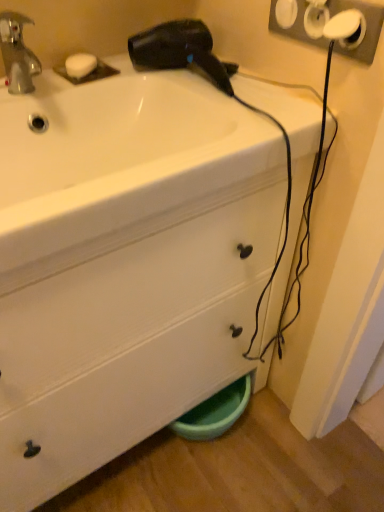
What are the coordinates of `white plastic socket at upper right` in the screenshot? It's located at (324, 23).

The image size is (384, 512). I want to click on black plastic hair dryer at upper center, so click(x=180, y=51).

From a real-world perspective, relative to white matte soap at upper left, is white plastic socket at upper right vertically above or below?

white plastic socket at upper right is above white matte soap at upper left.

From the image's perspective, would you say white plastic socket at upper right is positioned over white matte soap at upper left?

No.

Considering the sizes of objects white plastic socket at upper right and white matte soap at upper left in the image provided, who is bigger, white plastic socket at upper right or white matte soap at upper left?

Bigger between the two is white plastic socket at upper right.

Is white plastic socket at upper right closer to camera compared to white matte soap at upper left?

That is True.

From a real-world perspective, is white plastic socket at upper right positioned above or below black plastic hair dryer at upper center?

In terms of real-world spatial position, white plastic socket at upper right is above black plastic hair dryer at upper center.

Is white plastic socket at upper right not within black plastic hair dryer at upper center?

Absolutely, white plastic socket at upper right is external to black plastic hair dryer at upper center.

Based on the photo, how distant is white plastic socket at upper right from black plastic hair dryer at upper center?

white plastic socket at upper right and black plastic hair dryer at upper center are 7.52 inches apart.

Find the location of `hair drier that is on the left side of white plastic socket at upper right`. hair drier that is on the left side of white plastic socket at upper right is located at coordinates (180, 51).

From the picture: Between black plastic hair dryer at upper center and white matte soap at upper left, which one is positioned behind?

white matte soap at upper left is more distant.

From the image's perspective, is black plastic hair dryer at upper center located above or below white matte soap at upper left?

black plastic hair dryer at upper center is situated lower than white matte soap at upper left in the image.

How far apart are black plastic hair dryer at upper center and white matte soap at upper left?

The distance of black plastic hair dryer at upper center from white matte soap at upper left is 6.76 inches.

Which is behind, point (208, 60) or point (85, 60)?

The point (85, 60) is more distant.

Can you confirm if white matte soap at upper left is smaller than white plastic socket at upper right?

Indeed, white matte soap at upper left has a smaller size compared to white plastic socket at upper right.

Considering their positions, is white matte soap at upper left located in front of or behind white plastic socket at upper right?

white matte soap at upper left is behind white plastic socket at upper right.

From the picture: Is white matte soap at upper left placed right next to white plastic socket at upper right?

No, white matte soap at upper left is not next to white plastic socket at upper right.

Considering the positions of objects white matte soap at upper left and white plastic socket at upper right in the image provided, who is more to the left, white matte soap at upper left or white plastic socket at upper right?

From the viewer's perspective, white matte soap at upper left appears more on the left side.

Consider the image. Choose the correct answer: Is white matte soap at upper left inside black plastic hair dryer at upper center or outside it?

white matte soap at upper left is outside black plastic hair dryer at upper center.

Which object is more forward, white matte soap at upper left or black plastic hair dryer at upper center?

black plastic hair dryer at upper center is closer to the camera.

Is white matte soap at upper left positioned far away from black plastic hair dryer at upper center?

That's not correct — white matte soap at upper left is a little close to black plastic hair dryer at upper center.

From the picture: Between white matte soap at upper left and black plastic hair dryer at upper center, which one has smaller width?

white matte soap at upper left.

Is black plastic hair dryer at upper center aimed at white plastic socket at upper right?

No.

Visually, is black plastic hair dryer at upper center positioned to the left or to the right of white plastic socket at upper right?

Clearly, black plastic hair dryer at upper center is on the left of white plastic socket at upper right in the image.

Which is further, (163, 65) or (319, 6)?

Positioned behind is point (163, 65).

Considering the sizes of black plastic hair dryer at upper center and white plastic socket at upper right in the image, is black plastic hair dryer at upper center wider or thinner than white plastic socket at upper right?

black plastic hair dryer at upper center is wider than white plastic socket at upper right.

Identify the location of electric outlet that is on the right side of white matte soap at upper left. (324, 23).

Image resolution: width=384 pixels, height=512 pixels. I want to click on hair drier behind the white plastic socket at upper right, so click(x=180, y=51).

From the image, which object appears to be nearer to black plastic hair dryer at upper center, white plastic socket at upper right or white matte soap at upper left?

Based on the image, white matte soap at upper left appears to be nearer to black plastic hair dryer at upper center.

From the picture: Looking at the image, which one is located closer to white matte soap at upper left, white plastic socket at upper right or black plastic hair dryer at upper center?

black plastic hair dryer at upper center lies closer to white matte soap at upper left than the other object.

Looking at the image, which one is located further to white plastic socket at upper right, white matte soap at upper left or black plastic hair dryer at upper center?

white matte soap at upper left lies further to white plastic socket at upper right than the other object.

When comparing their distances from white plastic socket at upper right, does black plastic hair dryer at upper center or white matte soap at upper left seem further?

Among the two, white matte soap at upper left is located further to white plastic socket at upper right.

Looking at the image, which one is located further to black plastic hair dryer at upper center, white matte soap at upper left or white plastic socket at upper right?

white plastic socket at upper right is positioned further to the anchor black plastic hair dryer at upper center.

When comparing their distances from white matte soap at upper left, does black plastic hair dryer at upper center or white plastic socket at upper right seem further?

white plastic socket at upper right is positioned further to the anchor white matte soap at upper left.

You are a GUI agent. You are given a task and a screenshot of the screen. Output one action in this format:
    pyautogui.click(x=<x>, y=<y>)
    Task: Click on the hair drier between white matte soap at upper left and white plastic socket at upper right from left to right
    This screenshot has height=512, width=384.
    Given the screenshot: What is the action you would take?
    180,51